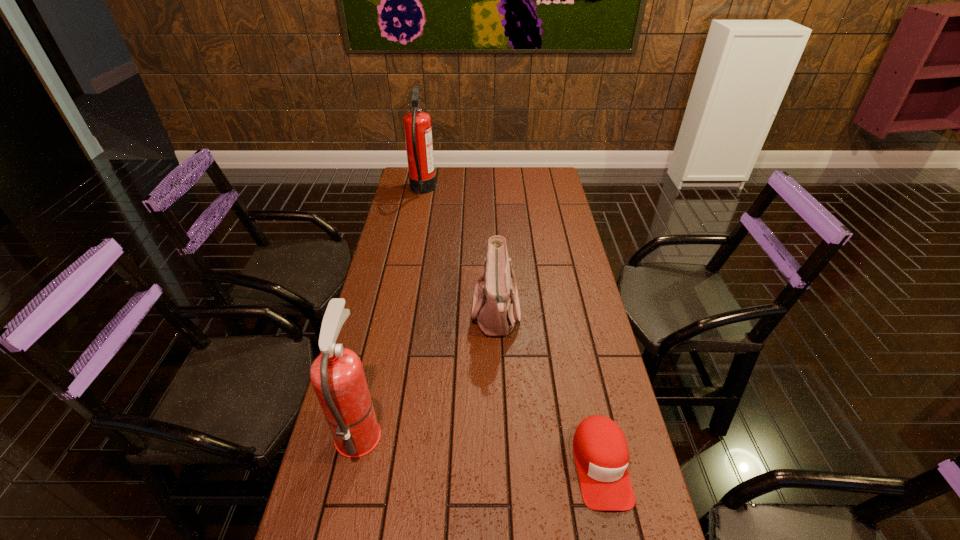
Image resolution: width=960 pixels, height=540 pixels. I want to click on unoccupied position between the third object from left to right and the baseball cap, so click(548, 389).

The image size is (960, 540). Identify the location of free space between the baseball cap and the third tallest object. (548, 389).

Identify the location of vacant area between the farther fire extinguisher and the nearer fire extinguisher. This screenshot has width=960, height=540. (391, 310).

At what (x,y) coordinates should I click in order to perform the action: click on empty space that is in between the nearer fire extinguisher and the second object from right to left. Please return your answer as a coordinate pair (x, y). Image resolution: width=960 pixels, height=540 pixels. Looking at the image, I should click on (427, 372).

The image size is (960, 540). I want to click on free space between the rightmost object and the nearer fire extinguisher, so click(480, 448).

Locate an element on the screen. This screenshot has width=960, height=540. vacant region between the baseball cap and the shoulder bag is located at coordinates (548, 389).

The width and height of the screenshot is (960, 540). Identify the location of object that stands as the second closest to the second object from right to left. (337, 375).

Select which object is the second closest to the farthest object. Please provide its 2D coordinates. Your answer should be formatted as a tuple, i.e. [(x, y)], where the tuple contains the x and y coordinates of a point satisfying the conditions above.

[(337, 375)]